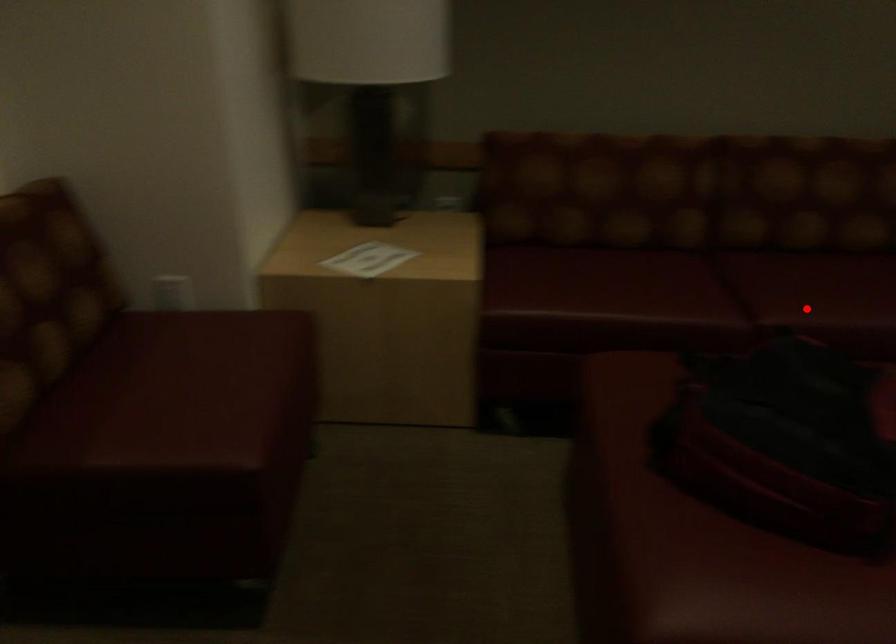
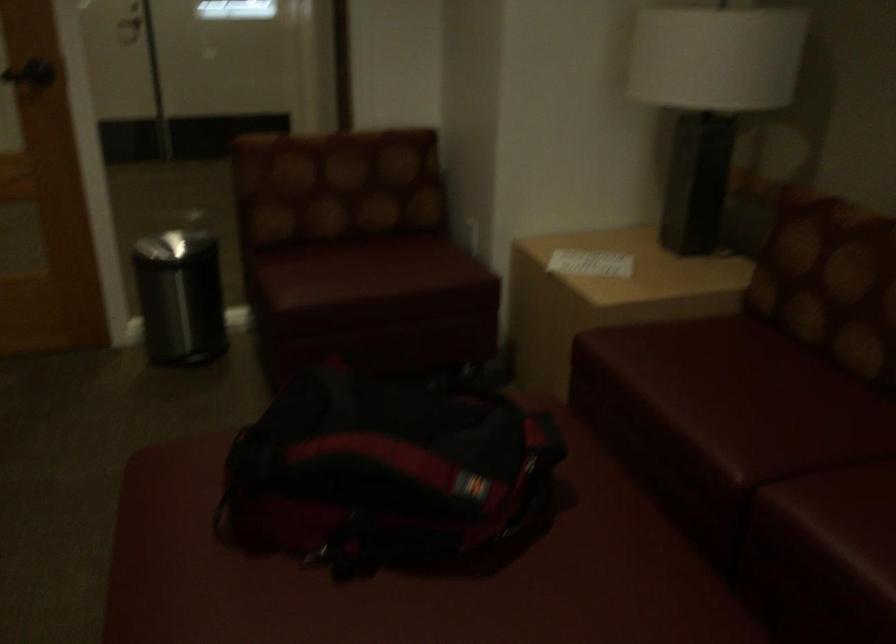
Locate, in the second image, the point that corresponds to the highlighted location in the first image.

(834, 522)